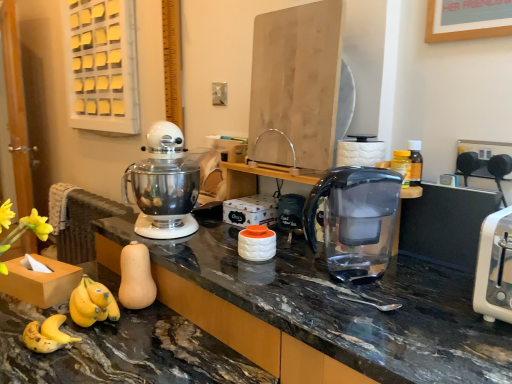
Where is `free space on the front side of transparent plastic water filter pitcher at center`? This screenshot has width=512, height=384. free space on the front side of transparent plastic water filter pitcher at center is located at coordinates (366, 312).